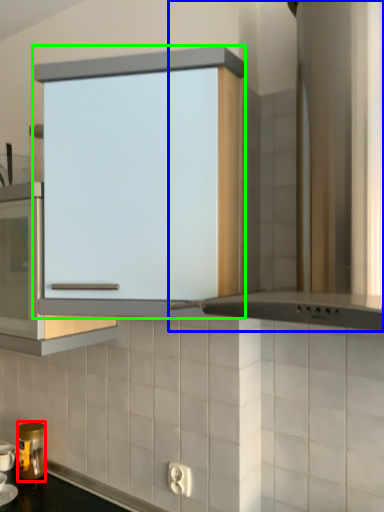
Question: Which object is the closest to the kitchen appliance (highlighted by a red box)? Choose among these: home appliance (highlighted by a blue box) or cabinetry (highlighted by a green box).

Choices:
 (A) home appliance
 (B) cabinetry

Answer: (B)